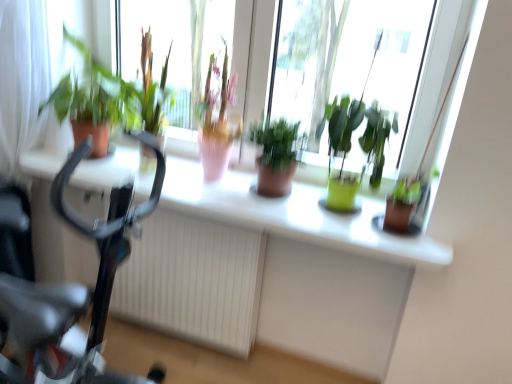
Question: Is black glossy bicycle at left bigger than green matte pot at right, the 1th houseplant viewed from the right?

Choices:
 (A) no
 (B) yes

Answer: (B)

Question: Is black glossy bicycle at left taller than green matte pot at right, which ranks as the 4th houseplant in left-to-right order?

Choices:
 (A) no
 (B) yes

Answer: (B)

Question: Is black glossy bicycle at left facing towards green matte pot at right, which ranks as the 4th houseplant in left-to-right order?

Choices:
 (A) no
 (B) yes

Answer: (A)

Question: Is black glossy bicycle at left thinner than green matte pot at right, the 1th houseplant viewed from the right?

Choices:
 (A) no
 (B) yes

Answer: (A)

Question: Is black glossy bicycle at left not within green matte pot at right, which ranks as the 4th houseplant in left-to-right order?

Choices:
 (A) no
 (B) yes

Answer: (B)

Question: Does black glossy bicycle at left have a smaller size compared to green matte pot at right, the 1th houseplant viewed from the right?

Choices:
 (A) yes
 (B) no

Answer: (B)

Question: Does matte brown pot at center, the 3th houseplant from the right, appear on the right side of white textured radiator at center?

Choices:
 (A) yes
 (B) no

Answer: (A)

Question: Is matte brown pot at center, the 3th houseplant from the right, far away from white textured radiator at center?

Choices:
 (A) yes
 (B) no

Answer: (B)

Question: From the image's perspective, would you say matte brown pot at center, the 3th houseplant from the right, is positioned over white textured radiator at center?

Choices:
 (A) yes
 (B) no

Answer: (A)

Question: From a real-world perspective, does matte brown pot at center, the 3th houseplant from the right, stand above white textured radiator at center?

Choices:
 (A) no
 (B) yes

Answer: (B)

Question: Is matte brown pot at center, the 3th houseplant from the right, closer to camera compared to white textured radiator at center?

Choices:
 (A) no
 (B) yes

Answer: (B)

Question: Is matte brown pot at center, the 3th houseplant from the right, wider than white textured radiator at center?

Choices:
 (A) no
 (B) yes

Answer: (B)

Question: Is green matte plant at left, the fourth houseplant positioned from the right, aimed at white textured radiator at center?

Choices:
 (A) no
 (B) yes

Answer: (A)